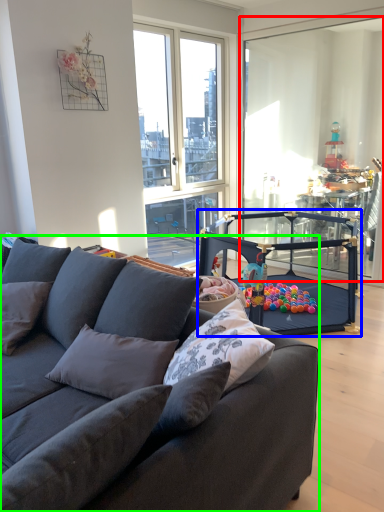
Question: Based on their relative distances, which object is farther from screen door (highlighted by a red box)? Choose from armchair (highlighted by a blue box) and studio couch (highlighted by a green box).

Choices:
 (A) armchair
 (B) studio couch

Answer: (B)